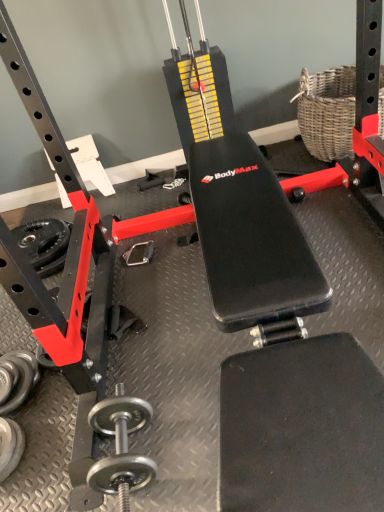
Where is `empty space that is to the right of polished silver dumbbell at lower left, which ranks as the third dumbbell in left-to-right order`? The width and height of the screenshot is (384, 512). empty space that is to the right of polished silver dumbbell at lower left, which ranks as the third dumbbell in left-to-right order is located at coordinates (186, 434).